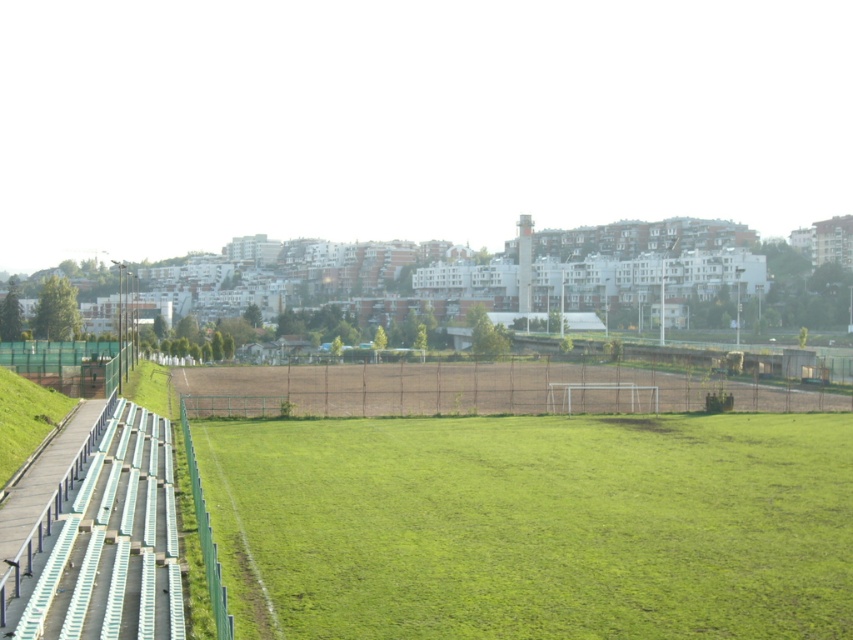
Question: Does brown mesh fence at center have a greater width compared to green mesh fence at left?

Choices:
 (A) no
 (B) yes

Answer: (B)

Question: Does green grass field at center appear on the left side of brown mesh fence at center?

Choices:
 (A) yes
 (B) no

Answer: (B)

Question: Among these objects, which one is farthest from the camera?

Choices:
 (A) brown mesh fence at center
 (B) green grass field at center
 (C) green mesh fence at left

Answer: (A)

Question: Which object is the closest to the green grass field at center?

Choices:
 (A) brown mesh fence at center
 (B) green mesh fence at left

Answer: (A)

Question: Which object appears farthest from the camera in this image?

Choices:
 (A) green mesh fence at left
 (B) brown mesh fence at center

Answer: (B)

Question: Does green grass field at center have a larger size compared to brown mesh fence at center?

Choices:
 (A) yes
 (B) no

Answer: (B)